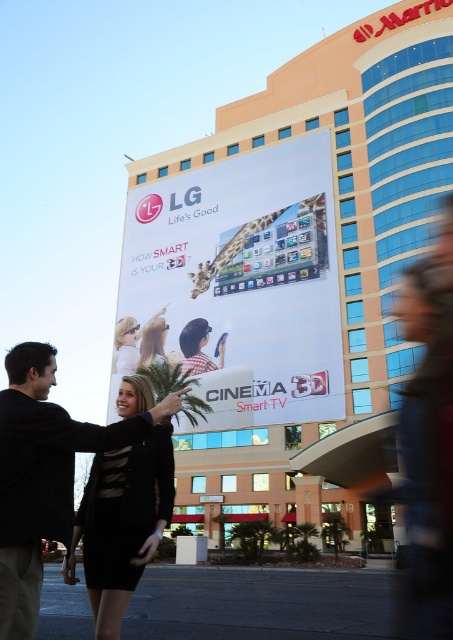
Question: Does white glossy billboard at center have a greater width compared to plaid shirt at center?

Choices:
 (A) yes
 (B) no

Answer: (A)

Question: Which point is farther to the camera?

Choices:
 (A) (172, 349)
 (B) (313, 168)
 (C) (149, 358)

Answer: (C)

Question: From the image, what is the correct spatial relationship of beige glass building at upper center in relation to white glossy billboard at center?

Choices:
 (A) above
 (B) below

Answer: (A)

Question: Which point is farther from the camera taking this photo?

Choices:
 (A) (145, 340)
 (B) (148, 337)
 (C) (231, 380)
 (D) (192, 342)

Answer: (B)

Question: Which of the following is the farthest from the observer?

Choices:
 (A) white glossy billboard at center
 (B) black matte suit at center
 (C) light brown hair at center

Answer: (C)

Question: In this image, where is matte black dress at center located relative to plaid shirt at center?

Choices:
 (A) below
 (B) above

Answer: (B)